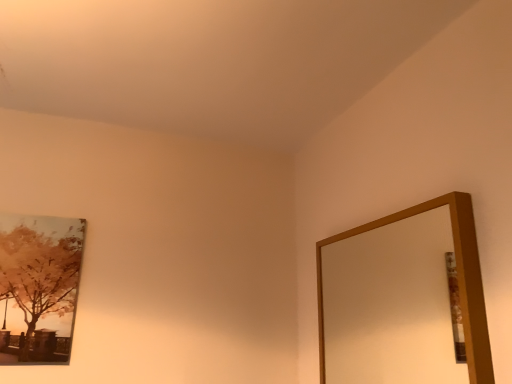
Question: Should I look upward or downward to see wooden-framed mirror at upper right?

Choices:
 (A) down
 (B) up

Answer: (A)